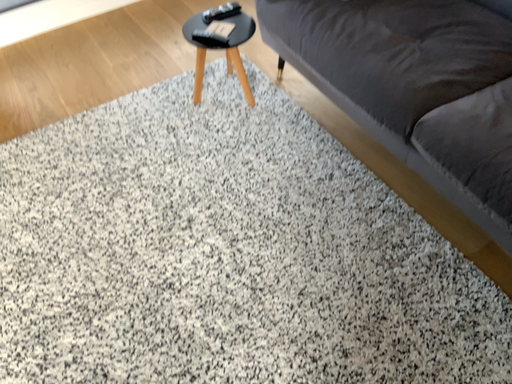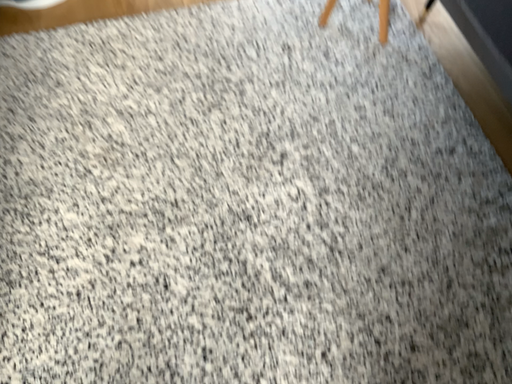
Question: How did the camera likely rotate when shooting the video?

Choices:
 (A) rotated right
 (B) rotated left

Answer: (B)